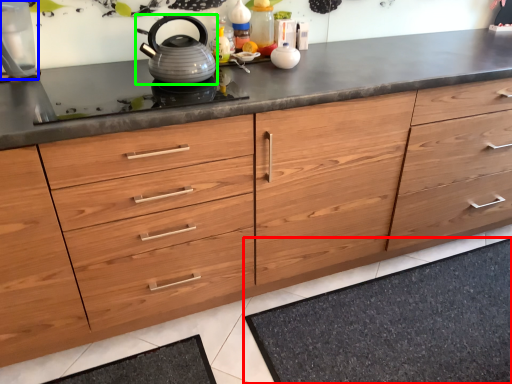
Question: Estimate the real-world distances between objects in this image. Which object is farther from bath mat (highlighted by a red box), appliance (highlighted by a blue box) or kettle (highlighted by a green box)?

Choices:
 (A) appliance
 (B) kettle

Answer: (A)